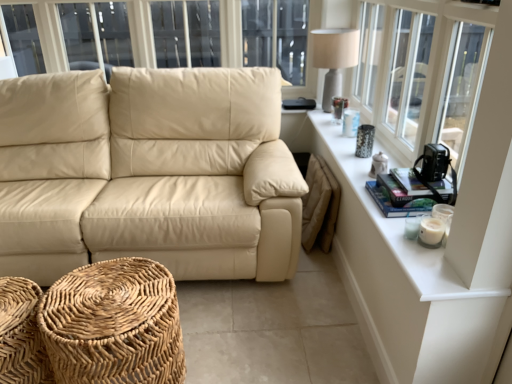
Question: Is woven wood footrest at lower left, positioned as the first footrest in left-to-right order, to the left or to the right of white ceramic table at upper right in the image?

Choices:
 (A) right
 (B) left

Answer: (B)

Question: From a real-world perspective, is woven wood footrest at lower left, positioned as the first footrest in left-to-right order, above or below white ceramic table at upper right?

Choices:
 (A) below
 (B) above

Answer: (A)

Question: Estimate the real-world distances between objects in this image. Which object is farther from the matte gray table lamp at upper right?

Choices:
 (A) woven wood footrest at lower left, positioned as the first footrest in left-to-right order
 (B) white textured windowsill at upper right
 (C) woven natural fiber footrest at lower left, the 2th footrest from the left
 (D) white ceramic table at upper right
 (E) beige leather couch at center

Answer: (A)

Question: Which object is the farthest from the beige leather couch at center?

Choices:
 (A) matte gray table lamp at upper right
 (B) white ceramic table at upper right
 (C) woven natural fiber footrest at lower left, the 2th footrest from the left
 (D) woven wood footrest at lower left, marked as the second footrest in a right-to-left arrangement
 (E) white textured windowsill at upper right

Answer: (A)